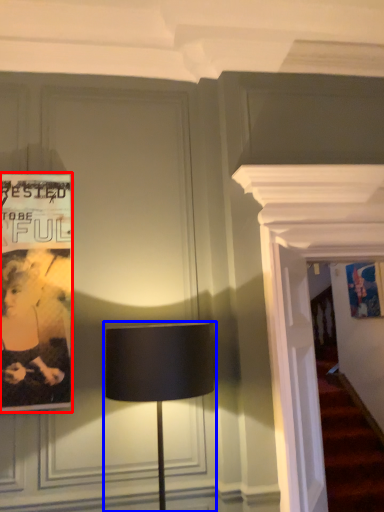
Question: Which point is further to the camera, poster (highlighted by a red box) or lamp (highlighted by a blue box)?

Choices:
 (A) poster
 (B) lamp

Answer: (A)